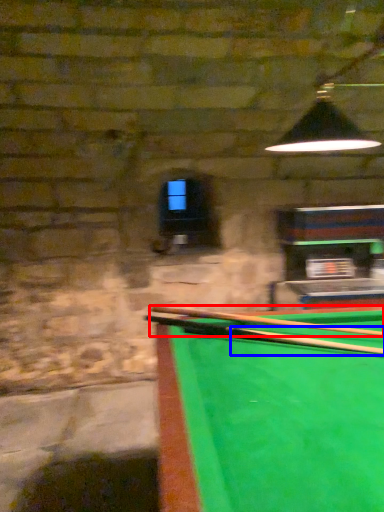
Question: Which object is closer to the camera taking this photo, cue (highlighted by a red box) or cue (highlighted by a blue box)?

Choices:
 (A) cue
 (B) cue

Answer: (B)